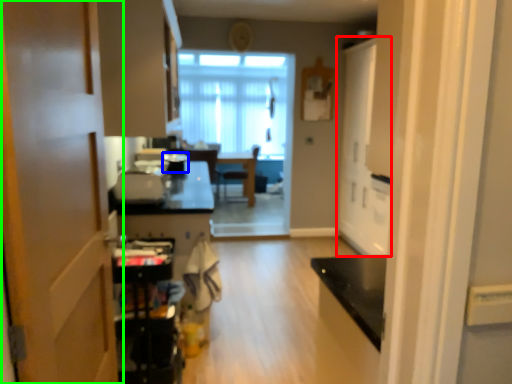
Question: Estimate the real-world distances between objects in this image. Which object is farther from door (highlighted by a red box), appliance (highlighted by a blue box) or door (highlighted by a green box)?

Choices:
 (A) appliance
 (B) door

Answer: (B)